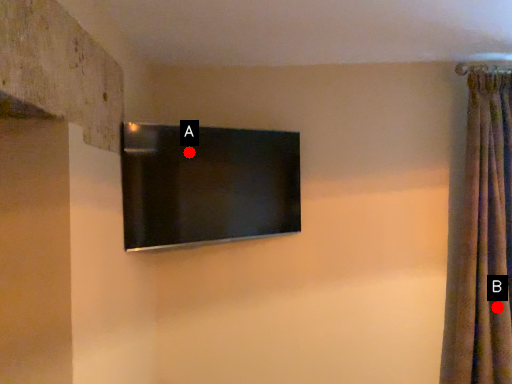
Question: Two points are circled on the image, labeled by A and B beside each circle. Which of the following is the farthest from the observer?

Choices:
 (A) A is further
 (B) B is further

Answer: (B)